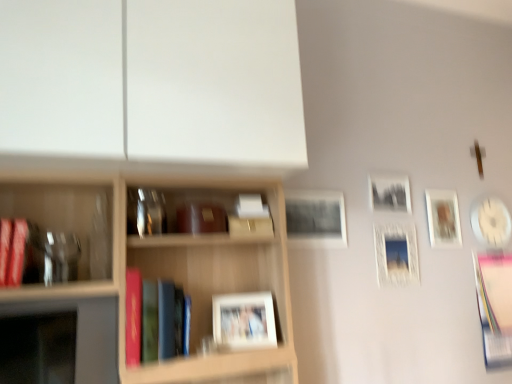
Question: Based on their positions, is matte red book at left, which is the third book in right-to-left order, located to the left or right of white glossy picture frame at upper right, the first picture frame viewed from the right?

Choices:
 (A) left
 (B) right

Answer: (A)

Question: From the image's perspective, is matte red book at left, the third book viewed from the back, located above or below white glossy picture frame at upper right, which appears as the 6th picture frame when viewed from the left?

Choices:
 (A) above
 (B) below

Answer: (B)

Question: Estimate the real-world distances between objects in this image. Which object is closer to the white glossy picture frame at upper right, the 3th picture frame from the front?

Choices:
 (A) pink paper book at right, the 1th book in the right-to-left sequence
 (B) black matte picture frame at upper right, placed as the third picture frame when sorted from left to right
 (C) matte black picture frame at center, the second picture frame from the left
 (D) wooden shelf at upper left
 (E) matte red book at left, arranged as the first book when viewed from the left

Answer: (B)

Question: Considering the real-world distances, which object is farthest from the matte black picture frame at center, which is the fifth picture frame in back-to-front order?

Choices:
 (A) matte red book at left, which is the third book in right-to-left order
 (B) black matte picture frame at upper right, marked as the 4th picture frame in a right-to-left arrangement
 (C) matte white picture frame at center, acting as the first picture frame starting from the left
 (D) white glossy picture frame at upper right, acting as the fourth picture frame starting from the back
 (E) wooden shelf at upper left

Answer: (A)